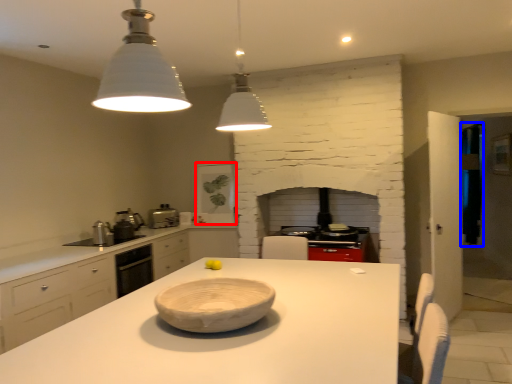
Question: Among these objects, which one is farthest to the camera, appliance (highlighted by a red box) or glass door (highlighted by a blue box)?

Choices:
 (A) appliance
 (B) glass door

Answer: (B)